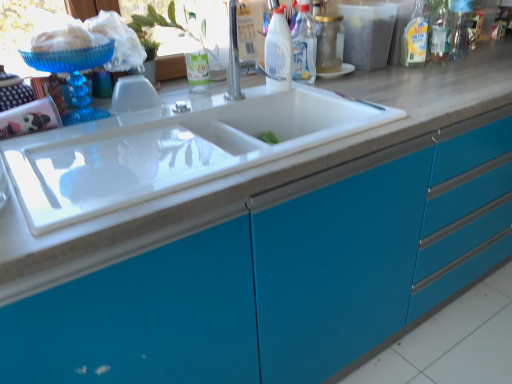
Find the location of a particular element. The height and width of the screenshot is (384, 512). unoccupied region to the right of white glossy bottle at upper center, the second bottle in the left-to-right sequence is located at coordinates (355, 82).